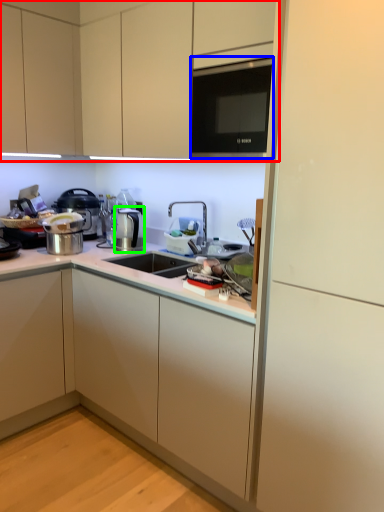
Question: Which object is the closest to the cabinetry (highlighted by a red box)? Choose among these: microwave (highlighted by a blue box) or coffee machine (highlighted by a green box).

Choices:
 (A) microwave
 (B) coffee machine

Answer: (A)